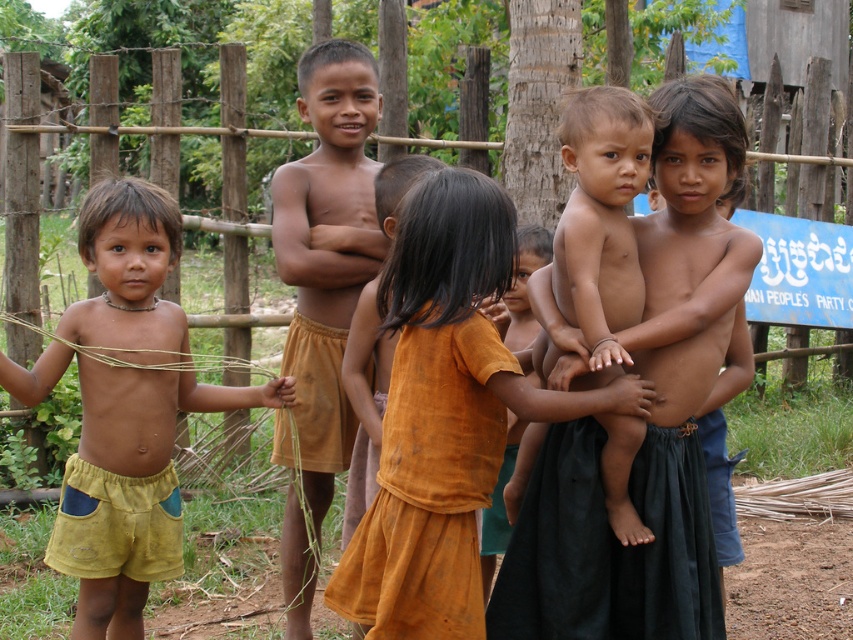
Based on the scene description, can you determine if the brown skin boy at center is wider than the brown cotton shorts at center?

Yes, the brown skin boy at center is wider than the brown cotton shorts at center according to the description.

You are a photographer trying to capture a clear shot of the orange cotton dress at center and the yellow cotton shorts at left. Which one will appear larger in your photo?

The orange cotton dress at center will appear larger in the photo because it is closer to the viewer than the yellow cotton shorts at left.